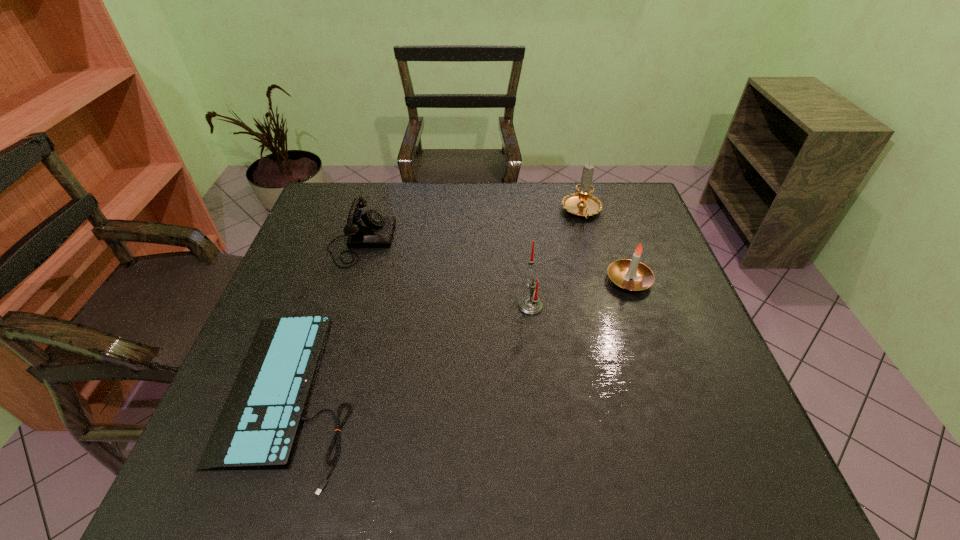
Locate an element on the screen. This screenshot has height=540, width=960. free space located on the front face of the second shortest object is located at coordinates (498, 240).

The height and width of the screenshot is (540, 960). Find the location of `vacant space situated 0.340m on the right of the shortest object`. vacant space situated 0.340m on the right of the shortest object is located at coordinates point(518,394).

Where is `candle positioned at the far edge`? This screenshot has height=540, width=960. candle positioned at the far edge is located at coordinates (582, 204).

Where is `telephone present at the far edge`? This screenshot has height=540, width=960. telephone present at the far edge is located at coordinates (369, 229).

This screenshot has height=540, width=960. I want to click on object located in the near edge section of the desktop, so click(x=258, y=427).

Find the location of a particular element. The height and width of the screenshot is (540, 960). telephone at the left edge is located at coordinates (369, 229).

The height and width of the screenshot is (540, 960). In order to click on computer keyboard positioned at the left edge in this screenshot , I will do `click(258, 427)`.

Identify the location of object at the far left corner. The width and height of the screenshot is (960, 540). (369, 229).

Locate an element on the screen. This screenshot has width=960, height=540. object at the near left corner is located at coordinates (258, 427).

This screenshot has width=960, height=540. In order to click on object located at the far right corner in this screenshot , I will do `click(582, 204)`.